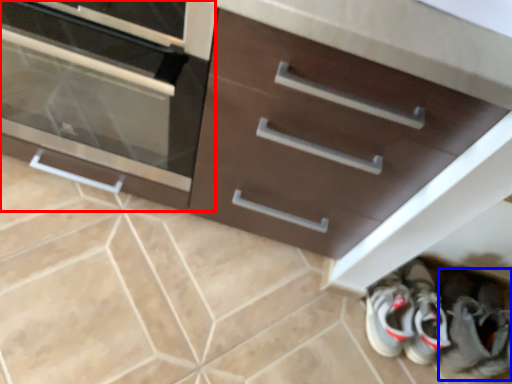
Question: Which point is closer to the camera, chest of drawers (highlighted by a red box) or footwear (highlighted by a blue box)?

Choices:
 (A) chest of drawers
 (B) footwear

Answer: (A)